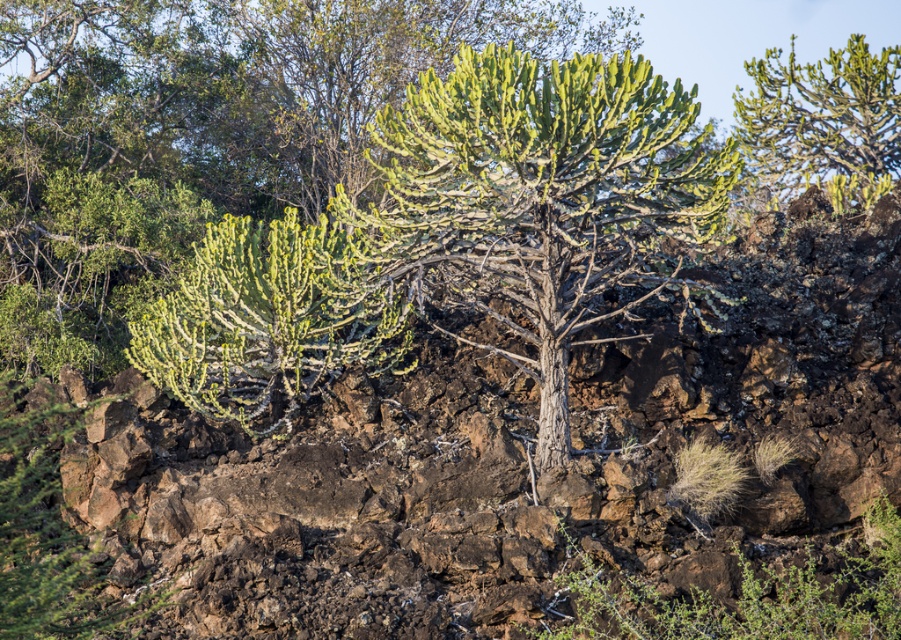
You are a hiker who has just arrived at this arid landscape. You need to reach the green spiny plant at upper right but must avoid stepping on the green succulent at center. What is the minimum distance you must walk to reach the plant without crossing the succulent?

The minimum distance you must walk to reach the green spiny plant at upper right without crossing the green succulent at center is approximately 13 meters, as the direct path between them is 13 meters.